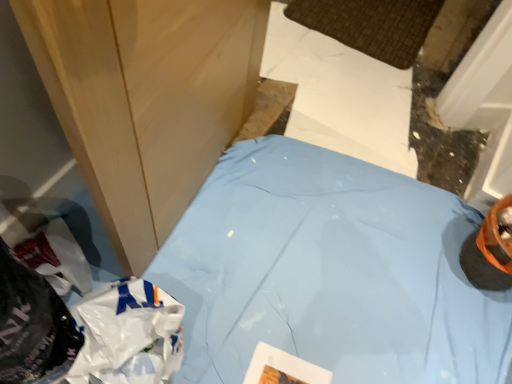
In order to click on blue fabric at center in this screenshot , I will do `click(329, 272)`.

Image resolution: width=512 pixels, height=384 pixels. Describe the element at coordinates (329, 272) in the screenshot. I see `blue fabric at center` at that location.

What are the coordinates of `blue fabric at center` in the screenshot? It's located at (329, 272).